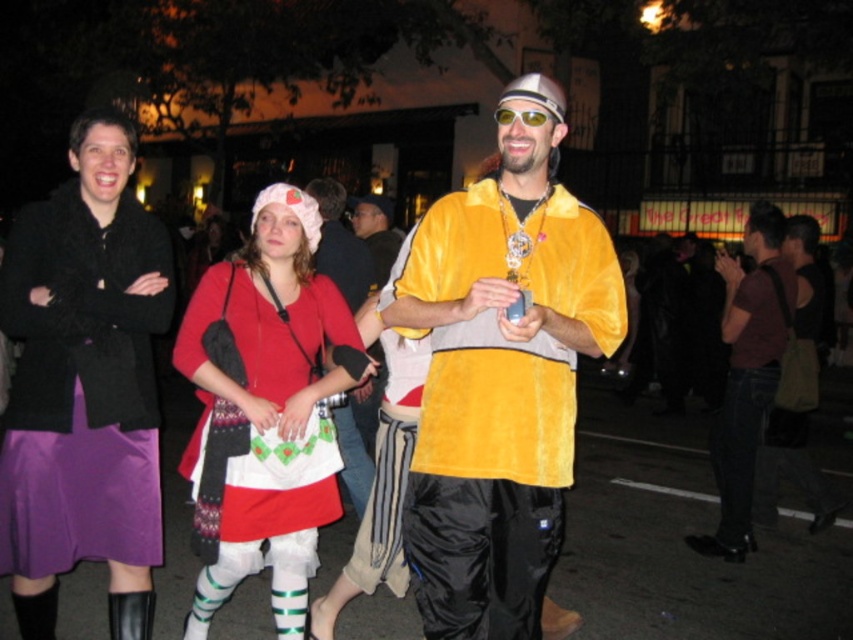
Which is more to the right, velvet gold cape at center or maroon fabric shirt at center?

maroon fabric shirt at center is more to the right.

Is the position of velvet gold cape at center less distant than that of maroon fabric shirt at center?

Yes, velvet gold cape at center is in front of maroon fabric shirt at center.

Where is `velvet gold cape at center`? velvet gold cape at center is located at coordinates (500, 376).

What are the coordinates of `velvet gold cape at center` in the screenshot? It's located at (500, 376).

Is purple satin skirt at center positioned in front of matte red dress at center?

Yes, it is.

Who is lower down, purple satin skirt at center or matte red dress at center?

matte red dress at center

This screenshot has width=853, height=640. I want to click on purple satin skirt at center, so click(x=84, y=385).

Locate an element on the screen. purple satin skirt at center is located at coordinates (84, 385).

Between point (534, 163) and point (97, 419), which one is positioned behind?

The point (97, 419) is more distant.

Does point (497, 269) come in front of point (132, 333)?

Yes, it is.

Locate an element on the screen. The image size is (853, 640). velvet gold cape at center is located at coordinates (500, 376).